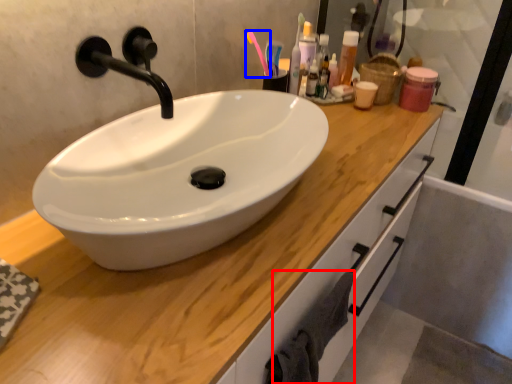
Question: Which of the following is the farthest to the observer, bath towel (highlighted by a red box) or toothbrush (highlighted by a blue box)?

Choices:
 (A) bath towel
 (B) toothbrush

Answer: (B)